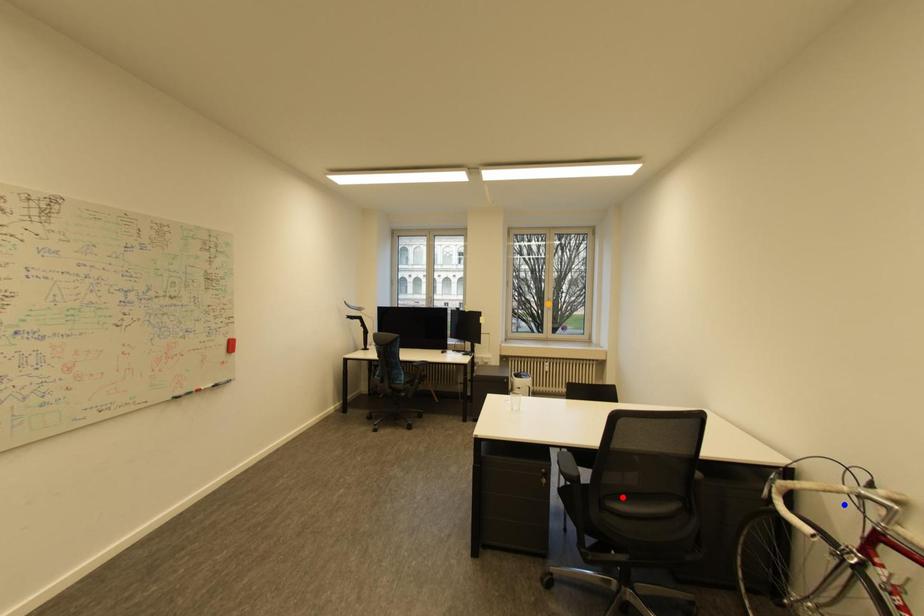
Order these from nearest to farthest:
A) red point
B) blue point
C) orange point

1. blue point
2. red point
3. orange point